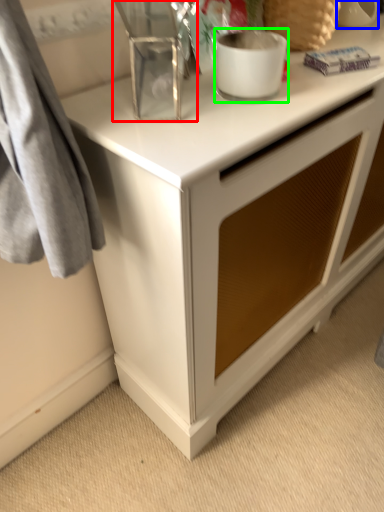
Question: Which object is the closest to the appliance (highlighted by a red box)? Choose among these: appliance (highlighted by a blue box) or appliance (highlighted by a green box).

Choices:
 (A) appliance
 (B) appliance

Answer: (B)